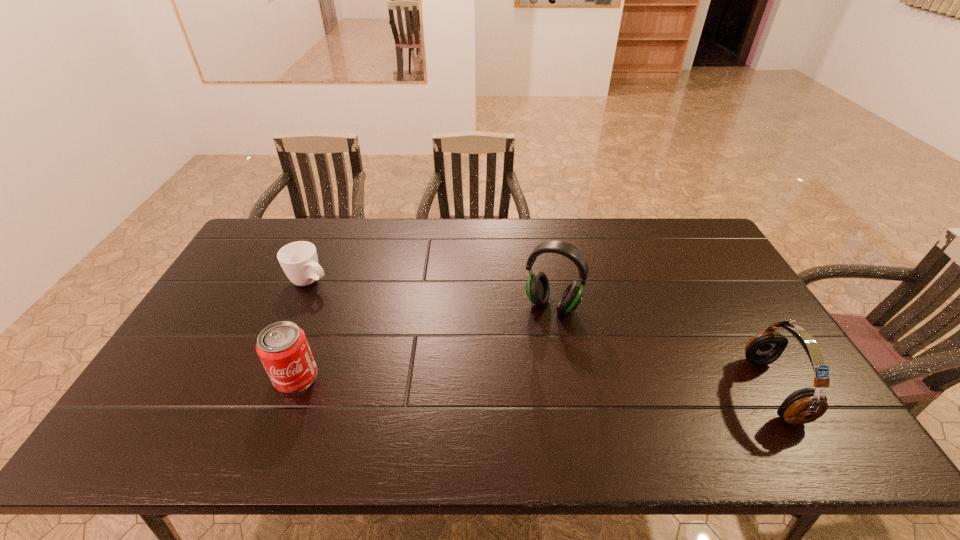
At what (x,y) coordinates should I click in order to perform the action: click on vacant space located 0.330m on the ear cups of the tallest object. Please return your answer as a coordinate pair (x, y). The height and width of the screenshot is (540, 960). Looking at the image, I should click on (501, 411).

This screenshot has height=540, width=960. I want to click on blank area located 0.270m on the ear cups of the tallest object, so click(510, 392).

Locate an element on the screen. The width and height of the screenshot is (960, 540). free space located on the ear cups of the tallest object is located at coordinates (504, 404).

The image size is (960, 540). What are the coordinates of `can at the near edge` in the screenshot? It's located at (282, 347).

Where is `headset positioned at the near edge`? The image size is (960, 540). headset positioned at the near edge is located at coordinates (803, 406).

Find the location of a particular element. Image resolution: width=960 pixels, height=540 pixels. object positioned at the right edge is located at coordinates (803, 406).

Identify the location of object situated at the near right corner. This screenshot has width=960, height=540. (803, 406).

Locate an element on the screen. vacant space at the far edge of the desktop is located at coordinates (627, 248).

At what (x,y) coordinates should I click in order to perform the action: click on vacant region at the near edge. Please return your answer as a coordinate pair (x, y). The image size is (960, 540). Looking at the image, I should click on (477, 389).

In the image, there is a desktop. At what (x,y) coordinates should I click in order to perform the action: click on free space at the left edge. Please return your answer as a coordinate pair (x, y). The width and height of the screenshot is (960, 540). Looking at the image, I should click on (231, 309).